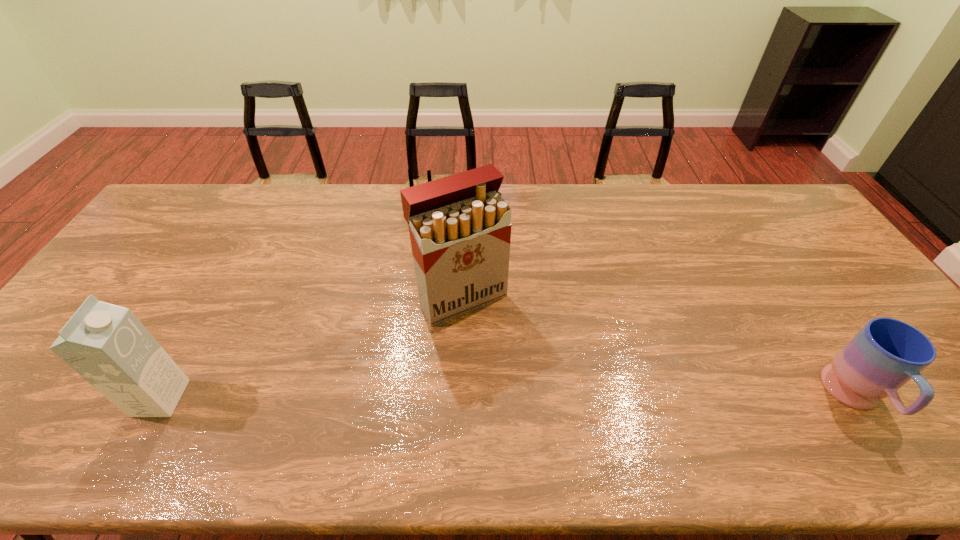
The image size is (960, 540). In order to click on vacant space on the desktop that is between the leftmost object and the mug and is positioned on the back of the router in this screenshot , I will do `click(410, 398)`.

Image resolution: width=960 pixels, height=540 pixels. What are the coordinates of `free space on the desktop that is between the third shortest object and the rightmost object and is positioned with the lid open on the cigarette case` in the screenshot? It's located at (528, 398).